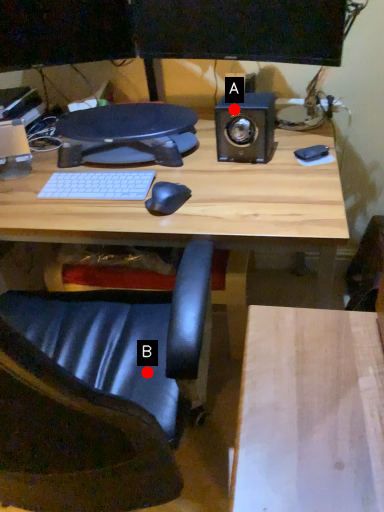
Question: Two points are circled on the image, labeled by A and B beside each circle. Which of the following is the closest to the observer?

Choices:
 (A) A is closer
 (B) B is closer

Answer: (B)